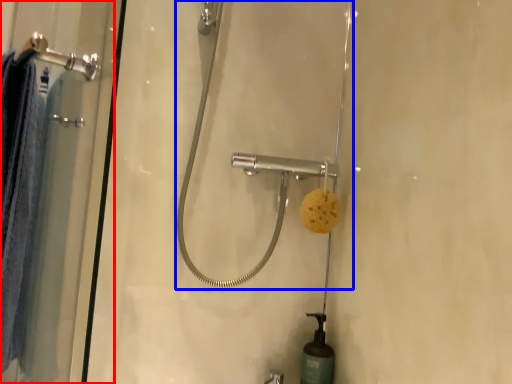
Question: Which point is further to the camera, shower door (highlighted by a red box) or shower (highlighted by a blue box)?

Choices:
 (A) shower door
 (B) shower

Answer: (B)